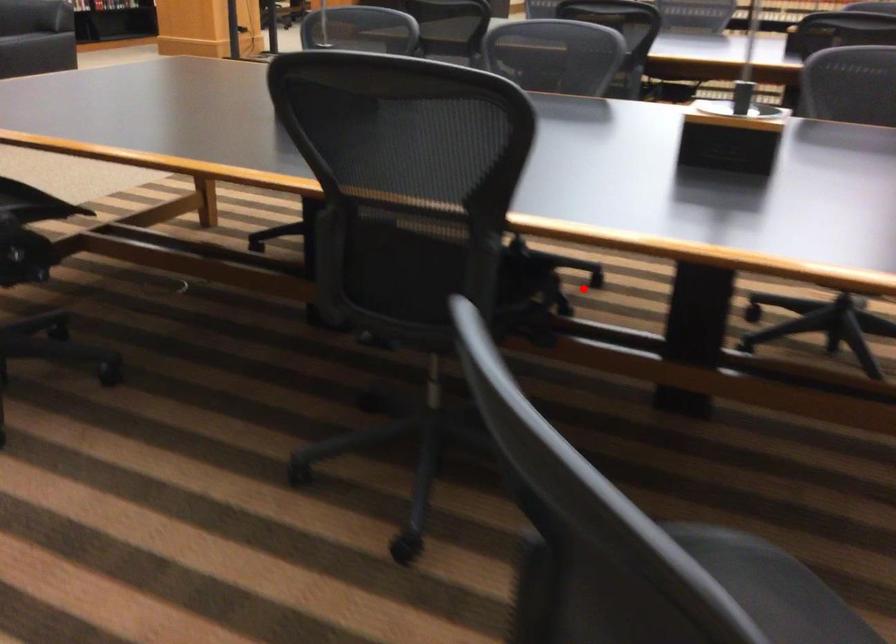
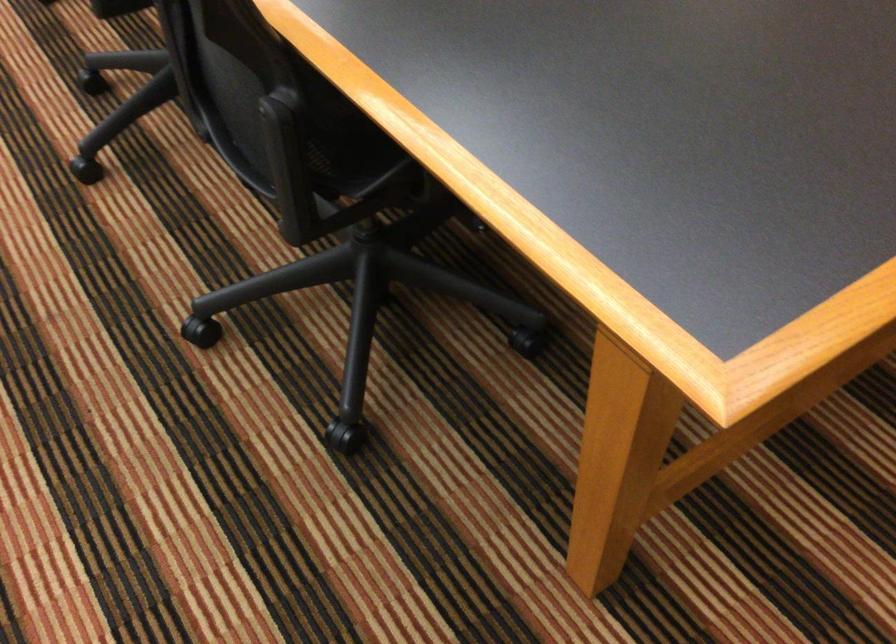
Find the pixel in the second image that matches the highlighted location in the first image.

(91, 82)